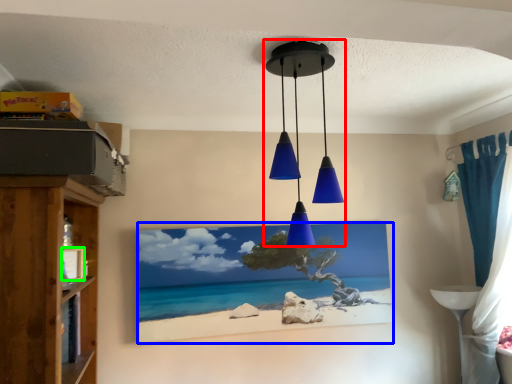
Question: Estimate the real-world distances between objects in this image. Which object is farther from lamp (highlighted by a red box), picture frame (highlighted by a blue box) or picture frame (highlighted by a green box)?

Choices:
 (A) picture frame
 (B) picture frame

Answer: (B)